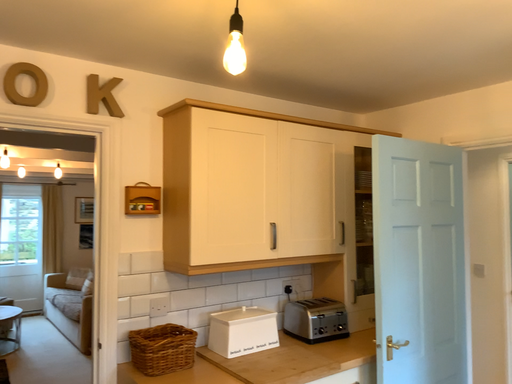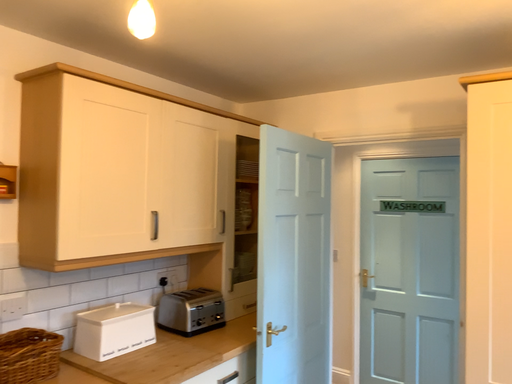
Question: How did the camera likely rotate when shooting the video?

Choices:
 (A) rotated right
 (B) rotated left

Answer: (A)